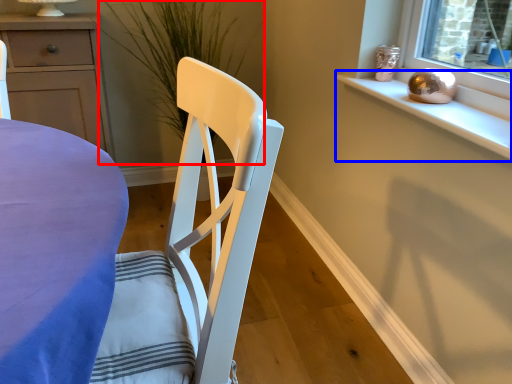
Question: Which of the following is the closest to the observer, plant (highlighted by a red box) or window sill (highlighted by a blue box)?

Choices:
 (A) plant
 (B) window sill

Answer: (B)